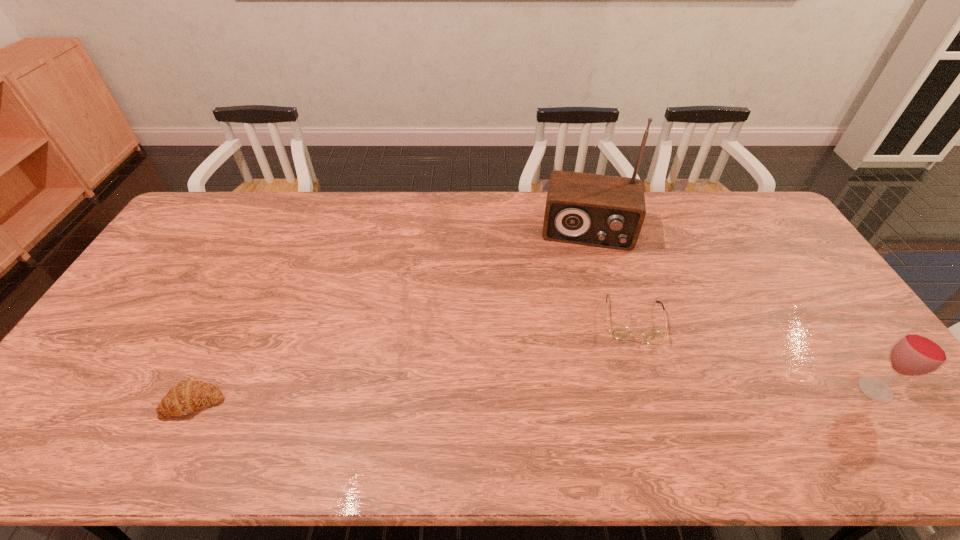
Identify the location of vacant area that lies between the third shortest object and the spectacles. The height and width of the screenshot is (540, 960). (754, 354).

You are a GUI agent. You are given a task and a screenshot of the screen. Output one action in this format:
    pyautogui.click(x=<x>, y=<y>)
    Task: Click on the vacant area that lies between the spectacles and the crescent roll
    Image resolution: width=960 pixels, height=540 pixels.
    Given the screenshot: What is the action you would take?
    pyautogui.click(x=414, y=361)

Image resolution: width=960 pixels, height=540 pixels. In order to click on free spot between the spectacles and the tallest object in this screenshot , I will do `click(611, 274)`.

You are a GUI agent. You are given a task and a screenshot of the screen. Output one action in this format:
    pyautogui.click(x=<x>, y=<y>)
    Task: Click on the unoccupied position between the radio receiver and the wineglass
    
    Given the screenshot: What is the action you would take?
    pyautogui.click(x=732, y=310)

Locate an element on the screen. The image size is (960, 540). the second closest object to the farthest object is located at coordinates [917, 352].

Select which object appears as the third closest to the leftmost object. Please provide its 2D coordinates. Your answer should be formatted as a tuple, i.e. [(x, y)], where the tuple contains the x and y coordinates of a point satisfying the conditions above.

[(917, 352)]

Identify the location of free spot that satisfies the following two spatial constraints: 1. on the front side of the rightmost object; 2. on the left side of the third nearest object. The width and height of the screenshot is (960, 540). (655, 390).

Locate an element on the screen. The image size is (960, 540). vacant point that satisfies the following two spatial constraints: 1. on the front side of the spectacles; 2. on the right side of the wineglass is located at coordinates (655, 390).

This screenshot has width=960, height=540. What are the coordinates of `blank space that satisfies the following two spatial constraints: 1. on the back side of the wineglass; 2. on the right side of the crescent roll` in the screenshot? It's located at (201, 390).

You are a GUI agent. You are given a task and a screenshot of the screen. Output one action in this format:
    pyautogui.click(x=<x>, y=<y>)
    Task: Click on the free space that satisfies the following two spatial constraints: 1. on the back side of the leftmost object; 2. on the right side of the wineglass
    
    Given the screenshot: What is the action you would take?
    pyautogui.click(x=201, y=390)